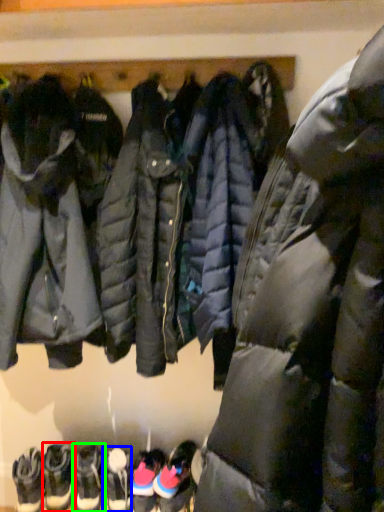
Question: Based on their relative distances, which object is nearer to footwear (highlighted by a red box)? Choose from footwear (highlighted by a blue box) and footwear (highlighted by a green box).

Choices:
 (A) footwear
 (B) footwear

Answer: (B)